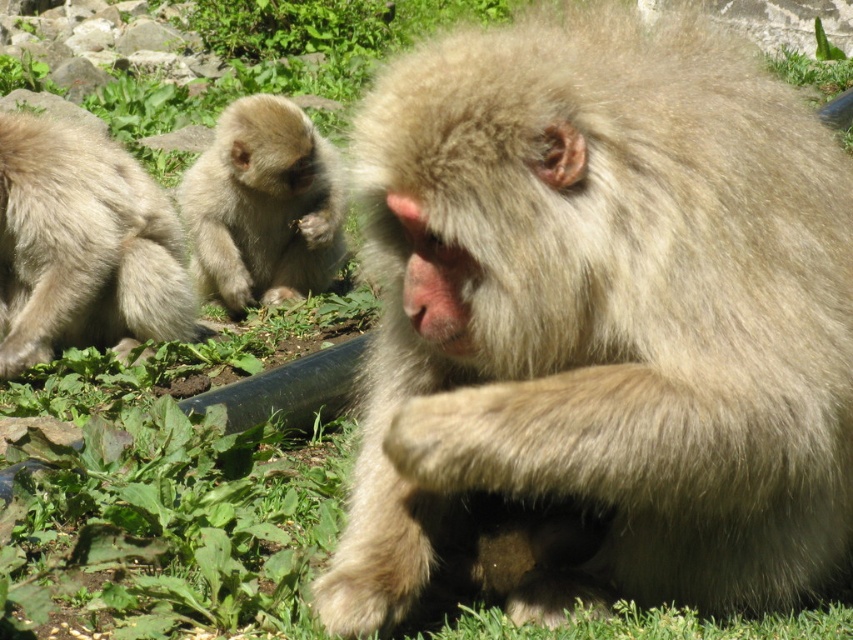
In the scene shown: Does fuzzy beige monkey at center appear on the right side of fuzzy beige monkey at left?

Indeed, fuzzy beige monkey at center is positioned on the right side of fuzzy beige monkey at left.

Is fuzzy beige monkey at center above fuzzy beige monkey at left?

Actually, fuzzy beige monkey at center is below fuzzy beige monkey at left.

Between point (483, 84) and point (140, 202), which one is positioned in front?

Point (483, 84) is more forward.

Identify the location of fuzzy beige monkey at center. (598, 324).

From the picture: Is fuzzy beige monkey at center to the left of fuzzy beige monkey at center left from the viewer's perspective?

No, fuzzy beige monkey at center is not to the left of fuzzy beige monkey at center left.

Can you confirm if fuzzy beige monkey at center is positioned to the right of fuzzy beige monkey at center left?

Correct, you'll find fuzzy beige monkey at center to the right of fuzzy beige monkey at center left.

I want to click on fuzzy beige monkey at center, so tap(598, 324).

Does point (4, 118) come farther from viewer compared to point (239, 188)?

No, (4, 118) is closer to viewer.

Who is higher up, fuzzy beige monkey at left or fuzzy beige monkey at center left?

fuzzy beige monkey at center left is higher up.

At what (x,y) coordinates should I click in order to perform the action: click on fuzzy beige monkey at left. Please return your answer as a coordinate pair (x, y). The width and height of the screenshot is (853, 640). Looking at the image, I should click on click(x=83, y=246).

The width and height of the screenshot is (853, 640). In order to click on fuzzy beige monkey at left in this screenshot , I will do `click(83, 246)`.